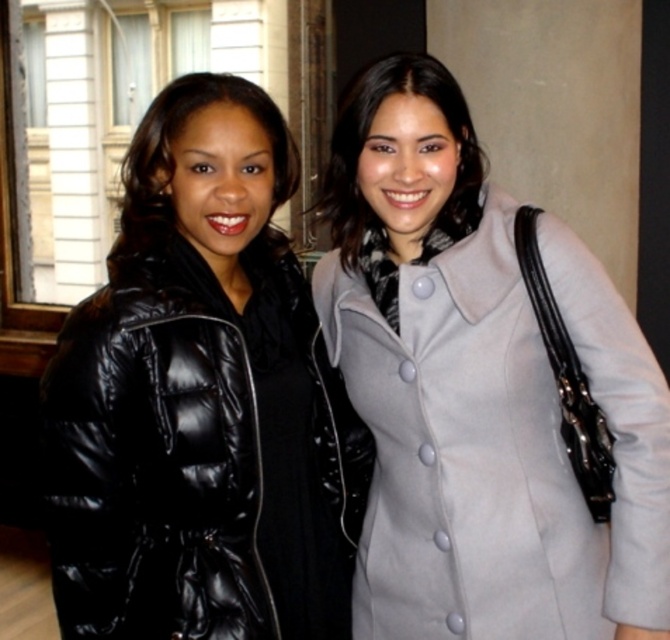
Question: Can you confirm if black glossy coat at left is thinner than black puffy coat at left?

Choices:
 (A) no
 (B) yes

Answer: (A)

Question: Which object is the farthest from the black puffy coat at left?

Choices:
 (A) matte black coat at center
 (B) black glossy coat at left

Answer: (B)

Question: Which point is closer to the camera?

Choices:
 (A) matte black coat at center
 (B) light gray wool coat at center
 (C) black glossy coat at left
 (D) black puffy coat at left

Answer: (B)

Question: Considering the relative positions of light gray wool coat at center and matte black coat at center in the image provided, where is light gray wool coat at center located with respect to matte black coat at center?

Choices:
 (A) right
 (B) left

Answer: (A)

Question: Which object appears farthest from the camera in this image?

Choices:
 (A) black puffy coat at left
 (B) light gray wool coat at center
 (C) matte black coat at center

Answer: (A)

Question: Can you confirm if black glossy coat at left is thinner than light gray wool coat at center?

Choices:
 (A) no
 (B) yes

Answer: (B)